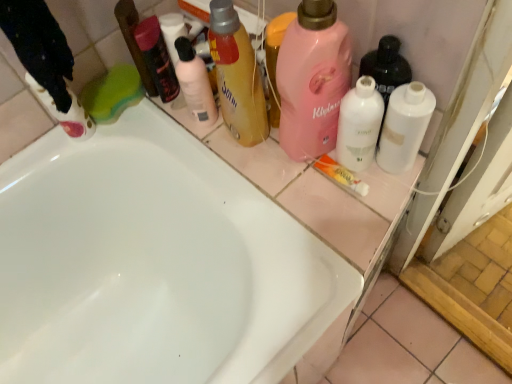
Question: Should I look upward or downward to see translucent yellow bottle at upper center, the 4th cleaning product from the left?

Choices:
 (A) down
 (B) up

Answer: (B)

Question: Is green sponge at upper left, which appears as the second cleaning product when viewed from the left, thinner than white matte bottle at right, which appears as the 1th cleaning product when viewed from the right?

Choices:
 (A) yes
 (B) no

Answer: (B)

Question: Could you tell me if green sponge at upper left, which appears as the second cleaning product when viewed from the left, is facing white matte bottle at right, acting as the seventh cleaning product starting from the left?

Choices:
 (A) no
 (B) yes

Answer: (B)

Question: Can you confirm if green sponge at upper left, which is the 6th cleaning product from right to left, is shorter than white matte bottle at right, acting as the seventh cleaning product starting from the left?

Choices:
 (A) no
 (B) yes

Answer: (B)

Question: Would you say green sponge at upper left, which is the 6th cleaning product from right to left, is outside white matte bottle at right, acting as the seventh cleaning product starting from the left?

Choices:
 (A) yes
 (B) no

Answer: (A)

Question: From a real-world perspective, is green sponge at upper left, which appears as the second cleaning product when viewed from the left, located beneath white matte bottle at right, which appears as the 1th cleaning product when viewed from the right?

Choices:
 (A) yes
 (B) no

Answer: (A)

Question: Does green sponge at upper left, which is the 6th cleaning product from right to left, have a smaller size compared to white matte bottle at right, which appears as the 1th cleaning product when viewed from the right?

Choices:
 (A) yes
 (B) no

Answer: (B)

Question: Is pink matte liquid at upper center, which is the fifth cleaning product from left to right, positioned with its back to matte white cleaning product at left, placed as the 7th cleaning product when sorted from right to left?

Choices:
 (A) yes
 (B) no

Answer: (B)

Question: Considering the relative sizes of pink matte liquid at upper center, which is the fifth cleaning product from left to right, and matte white cleaning product at left, placed as the 7th cleaning product when sorted from right to left, in the image provided, is pink matte liquid at upper center, which is the fifth cleaning product from left to right, taller than matte white cleaning product at left, placed as the 7th cleaning product when sorted from right to left,?

Choices:
 (A) no
 (B) yes

Answer: (B)

Question: From a real-world perspective, is pink matte liquid at upper center, which is the third cleaning product in right-to-left order, located beneath matte white cleaning product at left, placed as the 7th cleaning product when sorted from right to left?

Choices:
 (A) no
 (B) yes

Answer: (A)

Question: From the image's perspective, is pink matte liquid at upper center, which is the fifth cleaning product from left to right, located above matte white cleaning product at left, placed as the 7th cleaning product when sorted from right to left?

Choices:
 (A) no
 (B) yes

Answer: (A)

Question: Is pink matte liquid at upper center, which is the fifth cleaning product from left to right, surrounding matte white cleaning product at left, placed as the 7th cleaning product when sorted from right to left?

Choices:
 (A) no
 (B) yes

Answer: (A)

Question: Is pink matte liquid at upper center, which is the third cleaning product in right-to-left order, directly adjacent to matte white cleaning product at left, placed as the 1th cleaning product when sorted from left to right?

Choices:
 (A) yes
 (B) no

Answer: (B)

Question: Are matte black mouthwash at upper center and white matte bottle at right, acting as the seventh cleaning product starting from the left, far apart?

Choices:
 (A) no
 (B) yes

Answer: (A)